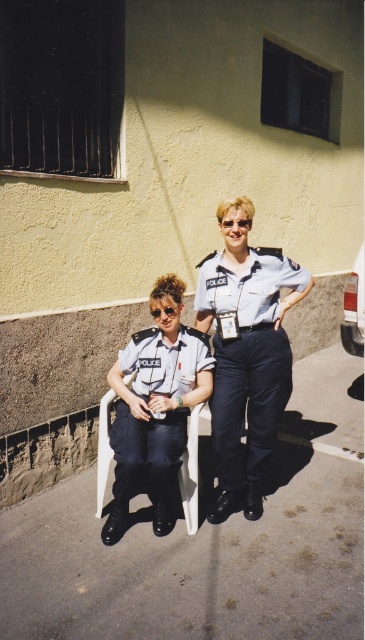
Question: Which point appears farthest from the camera in this image?

Choices:
 (A) (158, 440)
 (B) (267, 289)

Answer: (A)

Question: Among these points, which one is nearest to the camera?

Choices:
 (A) (243, 456)
 (B) (120, 436)

Answer: (B)

Question: Which of the following is the closest to the observer?

Choices:
 (A) matte white uniform at center
 (B) light blue fabric uniform at center

Answer: (A)

Question: Is light blue fabric uniform at center to the left of matte white uniform at center from the viewer's perspective?

Choices:
 (A) no
 (B) yes

Answer: (A)

Question: Does light blue fabric uniform at center appear under matte white uniform at center?

Choices:
 (A) yes
 (B) no

Answer: (B)

Question: Does light blue fabric uniform at center have a greater width compared to matte white uniform at center?

Choices:
 (A) no
 (B) yes

Answer: (B)